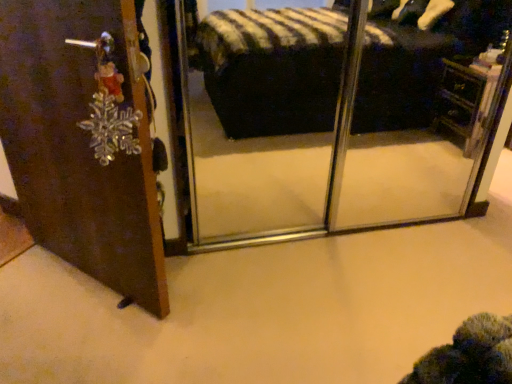
Describe the element at coordinates (465, 101) in the screenshot. This screenshot has height=384, width=512. I see `wooden vanity at right` at that location.

The image size is (512, 384). In order to click on wooden vanity at right in this screenshot , I will do `click(465, 101)`.

At what (x,y) coordinates should I click in order to perform the action: click on brown wooden door at left. Please return your answer as a coordinate pair (x, y). This screenshot has width=512, height=384. Looking at the image, I should click on (82, 143).

This screenshot has width=512, height=384. Describe the element at coordinates (82, 143) in the screenshot. I see `brown wooden door at left` at that location.

At what (x,y) coordinates should I click in order to perform the action: click on wooden vanity at right. Please return your answer as a coordinate pair (x, y). Image resolution: width=512 pixels, height=384 pixels. Looking at the image, I should click on (465, 101).

Is brown wooden door at left to the left or to the right of wooden vanity at right in the image?

From the image, it's evident that brown wooden door at left is to the left of wooden vanity at right.

Is the depth of brown wooden door at left greater than that of wooden vanity at right?

No, brown wooden door at left is closer to the viewer.

Which is less distant, (x=88, y=87) or (x=483, y=80)?

Clearly, point (x=88, y=87) is closer to the camera than point (x=483, y=80).

From the image's perspective, relative to wooden vanity at right, is brown wooden door at left above or below?

brown wooden door at left is situated lower than wooden vanity at right in the image.

From a real-world perspective, between brown wooden door at left and wooden vanity at right, who is vertically lower?

In real-world perspective, wooden vanity at right is lower.

Is brown wooden door at left wider or thinner than wooden vanity at right?

Clearly, brown wooden door at left has more width compared to wooden vanity at right.

Considering the sizes of objects brown wooden door at left and wooden vanity at right in the image provided, who is shorter, brown wooden door at left or wooden vanity at right?

wooden vanity at right is shorter.

Does brown wooden door at left have a larger size compared to wooden vanity at right?

Indeed, brown wooden door at left has a larger size compared to wooden vanity at right.

Is brown wooden door at left spatially inside wooden vanity at right, or outside of it?

brown wooden door at left is spatially situated outside wooden vanity at right.

Would you consider brown wooden door at left to be distant from wooden vanity at right?

brown wooden door at left is far away from wooden vanity at right.

Is brown wooden door at left oriented towards wooden vanity at right?

No, brown wooden door at left is not turned towards wooden vanity at right.

What's the angular difference between brown wooden door at left and wooden vanity at right's facing directions?

The angular difference between brown wooden door at left and wooden vanity at right is 46.8 degrees.

Find the location of a particular element. The image size is (512, 384). door in front of the wooden vanity at right is located at coordinates (82, 143).

Would you say wooden vanity at right is to the left or to the right of brown wooden door at left in the picture?

From the image, it's evident that wooden vanity at right is to the right of brown wooden door at left.

Which is in front, wooden vanity at right or brown wooden door at left?

Positioned in front is brown wooden door at left.

Is point (452, 113) closer or farther from the camera than point (44, 115)?

Point (452, 113) appears to be farther away from the viewer than point (44, 115).

From the image's perspective, which object appears higher, wooden vanity at right or brown wooden door at left?

From the image's view, wooden vanity at right is above.

From a real-world perspective, is wooden vanity at right under brown wooden door at left?

Yes, from a real-world perspective, wooden vanity at right is under brown wooden door at left.

Is wooden vanity at right wider than brown wooden door at left?

Incorrect, the width of wooden vanity at right does not surpass that of brown wooden door at left.

Does wooden vanity at right have a lesser height compared to brown wooden door at left?

Correct, wooden vanity at right is not as tall as brown wooden door at left.

Is wooden vanity at right bigger than brown wooden door at left?

No.

Does wooden vanity at right contain brown wooden door at left?

No, brown wooden door at left is not a part of wooden vanity at right.

Is wooden vanity at right far from brown wooden door at left?

Yes, wooden vanity at right and brown wooden door at left are quite far apart.

Is wooden vanity at right oriented towards brown wooden door at left?

No, wooden vanity at right is not turned towards brown wooden door at left.

Can you tell me how much wooden vanity at right and brown wooden door at left differ in facing direction?

The facing directions of wooden vanity at right and brown wooden door at left are 46.8 degrees apart.

Identify the location of door that appears above the wooden vanity at right (from a real-world perspective). (82, 143).

The image size is (512, 384). I want to click on door above the wooden vanity at right (from a real-world perspective), so click(82, 143).

In the image, there is a brown wooden door at left. Where is `vanity below it (from a real-world perspective)`? Image resolution: width=512 pixels, height=384 pixels. vanity below it (from a real-world perspective) is located at coordinates (465, 101).